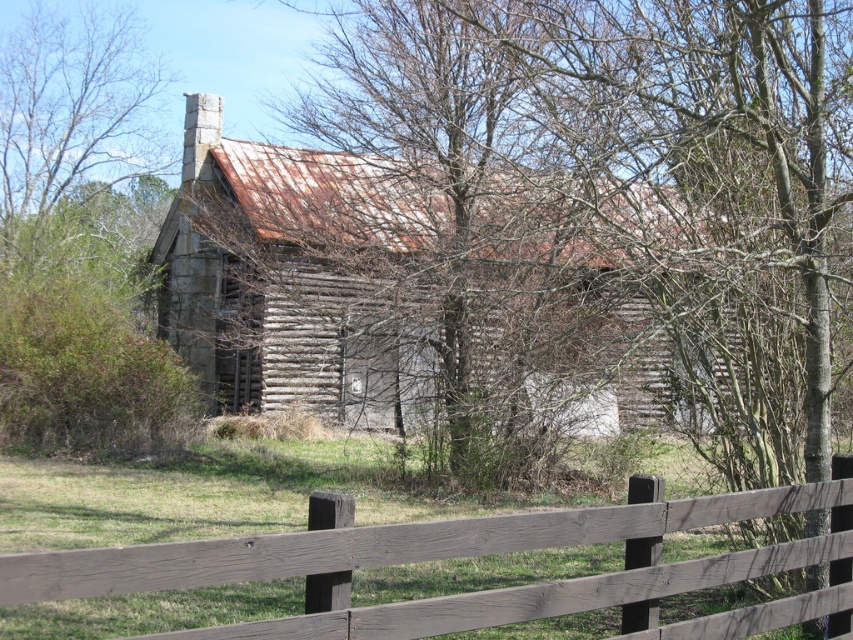
Who is taller, rusty wood cabin at center or brown wooden fence at lower center?

Standing taller between the two is rusty wood cabin at center.

Does rusty wood cabin at center have a smaller size compared to brown wooden fence at lower center?

No.

Between point (548, 228) and point (244, 566), which one is positioned behind?

Point (548, 228)

Identify the location of rusty wood cabin at center. This screenshot has width=853, height=640. (306, 276).